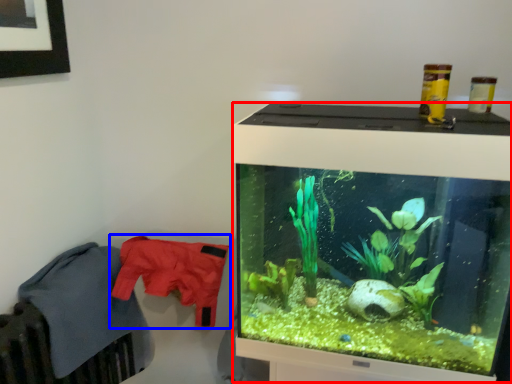
Question: Among these objects, which one is nearest to the camera, computer monitor (highlighted by a red box) or clothing (highlighted by a blue box)?

Choices:
 (A) computer monitor
 (B) clothing

Answer: (A)